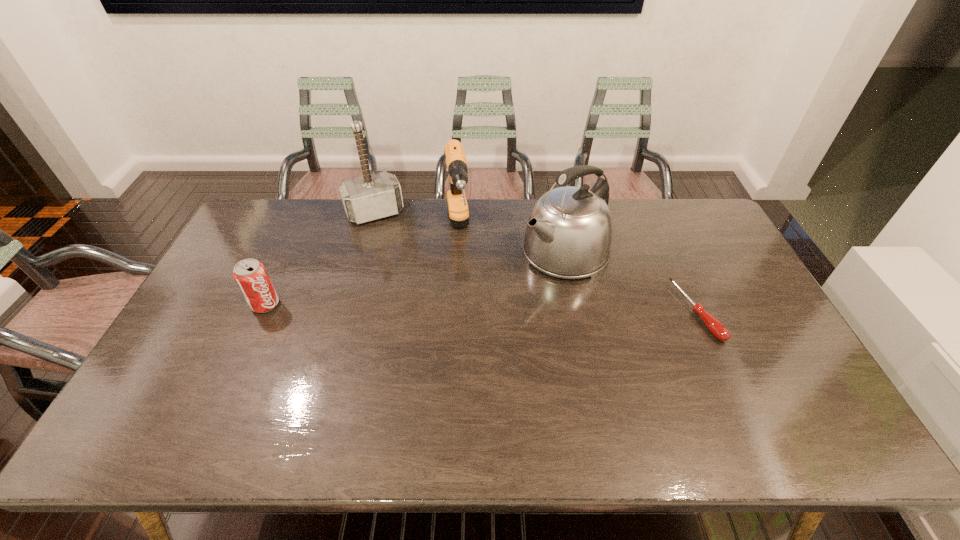
Locate an element on the screen. The width and height of the screenshot is (960, 540). free space on the desktop that is between the fourth tallest object and the shortest object and is positioned at the tip of the third object from right to left is located at coordinates (470, 308).

Locate an element on the screen. free space on the desktop that is between the leftmost object and the screwdriver and is positioned on the spout of the kettle is located at coordinates (482, 308).

Where is `free space on the desktop that is between the leftmost object and the screwdriver and is positioned for striking with the head of the hammer`? free space on the desktop that is between the leftmost object and the screwdriver and is positioned for striking with the head of the hammer is located at coordinates (419, 307).